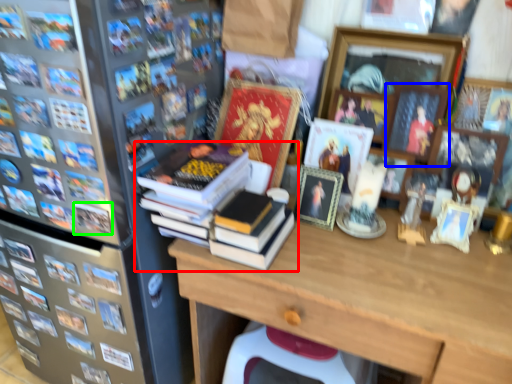
Question: Based on their relative distances, which object is nearer to book (highlighted by a red box)? Choose from picture frame (highlighted by a blue box) and book (highlighted by a green box).

Choices:
 (A) picture frame
 (B) book

Answer: (B)